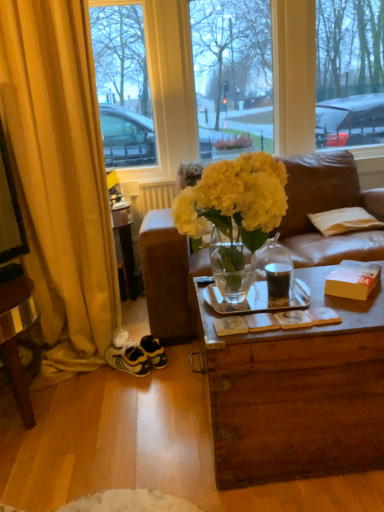
What is the approximate height of transparent glass window at center?

The height of transparent glass window at center is 3.78 feet.

What do you see at coordinates (167, 85) in the screenshot? The width and height of the screenshot is (384, 512). I see `transparent glass window at center` at bounding box center [167, 85].

You are a GUI agent. You are given a task and a screenshot of the screen. Output one action in this format:
    pyautogui.click(x=<x>, y=<y>)
    Task: Click on the orange cardboard box at right
    Image resolution: width=384 pixels, height=512 pixels.
    Given the screenshot: What is the action you would take?
    [353, 279]

Image resolution: width=384 pixels, height=512 pixels. What do you see at coordinates (353, 279) in the screenshot? I see `orange cardboard box at right` at bounding box center [353, 279].

Where is `white striped fabric pillow at right`? This screenshot has width=384, height=512. white striped fabric pillow at right is located at coordinates (344, 220).

Locate an element on the screen. white matte radiator at upper center is located at coordinates (150, 201).

You are a GUI agent. You are given a task and a screenshot of the screen. Output one action in this format:
    pyautogui.click(x=<x>, y=<y>)
    Task: Click on the yellow fabric curtain at left
    Image resolution: width=384 pixels, height=512 pixels.
    Given the screenshot: What is the action you would take?
    click(60, 179)

You are a GUI agent. You are given a task and a screenshot of the screen. Output one action in this format:
    pyautogui.click(x=<x>, y=<y>)
    Task: Click on the transparent glass window at center
    
    Given the screenshot: What is the action you would take?
    pyautogui.click(x=167, y=85)

Which object is thinner, yellow suede sneakers at lower left or transparent glass window at center?

transparent glass window at center is thinner.

Which object is positioned more to the right, yellow suede sneakers at lower left or transparent glass window at center?

Positioned to the right is transparent glass window at center.

Which is farther from the camera, (x=115, y=365) or (x=274, y=33)?

Positioned behind is point (x=274, y=33).

This screenshot has width=384, height=512. Find the location of `sneakers below the transparent glass window at center (from the image's perspective)`. sneakers below the transparent glass window at center (from the image's perspective) is located at coordinates (127, 356).

Are yellow suede sneakers at lower left and orange cardboard box at right located far from each other?

Actually, yellow suede sneakers at lower left and orange cardboard box at right are a little close together.

From the image's perspective, which is above, yellow suede sneakers at lower left or orange cardboard box at right?

orange cardboard box at right, from the image's perspective.

Is orange cardboard box at right at the back of yellow suede sneakers at lower left?

yellow suede sneakers at lower left is not turned away from orange cardboard box at right.

Is transparent glass window at center at the back of white matte radiator at upper center?

That's not correct — white matte radiator at upper center is not looking away from transparent glass window at center.

Consider the image. Is white matte radiator at upper center directly adjacent to transparent glass window at center?

white matte radiator at upper center and transparent glass window at center are clearly separated.

Considering the relative sizes of white matte radiator at upper center and transparent glass window at center in the image provided, is white matte radiator at upper center wider than transparent glass window at center?

No.

From the picture: In terms of size, does white matte radiator at upper center appear bigger or smaller than transparent glass window at center?

In the image, white matte radiator at upper center appears to be smaller than transparent glass window at center.

Is white striped fabric pillow at right next to yellow suede sneakers at lower left and touching it?

No, white striped fabric pillow at right is not in contact with yellow suede sneakers at lower left.

Which object is thinner, white striped fabric pillow at right or yellow suede sneakers at lower left?

With smaller width is white striped fabric pillow at right.

Considering the relative positions of white striped fabric pillow at right and yellow suede sneakers at lower left in the image provided, is white striped fabric pillow at right to the right of yellow suede sneakers at lower left from the viewer's perspective?

Yes.

Between white striped fabric pillow at right and orange cardboard box at right, which one has smaller width?

With smaller width is orange cardboard box at right.

Which object is closer to the camera taking this photo, white striped fabric pillow at right or orange cardboard box at right?

orange cardboard box at right is in front.

From the image's perspective, who appears lower, white striped fabric pillow at right or orange cardboard box at right?

orange cardboard box at right appears lower in the image.

From a real-world perspective, is white striped fabric pillow at right positioned over orange cardboard box at right based on gravity?

No, from a real-world perspective, white striped fabric pillow at right is not on top of orange cardboard box at right.

From the picture: Is yellow fabric curtain at left not inside transparent glass window at center?

Yes, yellow fabric curtain at left is located beyond the bounds of transparent glass window at center.

Considering the relative sizes of yellow fabric curtain at left and transparent glass window at center in the image provided, is yellow fabric curtain at left taller than transparent glass window at center?

Yes.

Which is more to the left, yellow fabric curtain at left or transparent glass window at center?

yellow fabric curtain at left is more to the left.

From the image's perspective, is yellow fabric curtain at left over transparent glass window at center?

Incorrect, from the image's perspective, yellow fabric curtain at left is lower than transparent glass window at center.

Does point (171, 192) come in front of point (337, 289)?

No, it is not.

How many degrees apart are the facing directions of white matte radiator at upper center and orange cardboard box at right?

The facing directions of white matte radiator at upper center and orange cardboard box at right are 41.7 degrees apart.

Consider the image. Is there a large distance between white matte radiator at upper center and orange cardboard box at right?

That's right, there is a large distance between white matte radiator at upper center and orange cardboard box at right.

Does white matte radiator at upper center appear on the left side of orange cardboard box at right?

Yes.

Where is `sneakers in front of the transparent glass window at center`? The image size is (384, 512). sneakers in front of the transparent glass window at center is located at coordinates (127, 356).

In order to click on sneakers that appears below the orange cardboard box at right (from a real-world perspective) in this screenshot , I will do `click(127, 356)`.

From the image, which object appears to be farther from white striped fabric pillow at right, transparent glass window at center or yellow suede sneakers at lower left?

Based on the image, yellow suede sneakers at lower left appears to be further to white striped fabric pillow at right.

From the image, which object appears to be farther from orange cardboard box at right, yellow suede sneakers at lower left or white matte radiator at upper center?

white matte radiator at upper center is positioned further to the anchor orange cardboard box at right.

From the image, which object appears to be farther from yellow fabric curtain at left, transparent glass window at center or orange cardboard box at right?

Based on the image, orange cardboard box at right appears to be further to yellow fabric curtain at left.

Considering their positions, is orange cardboard box at right positioned further to transparent glass window at center than translucent leather couch at center?

orange cardboard box at right is positioned further to the anchor transparent glass window at center.

Which object lies further to the anchor point orange cardboard box at right, white matte radiator at upper center or yellow suede sneakers at lower left?

white matte radiator at upper center lies further to orange cardboard box at right than the other object.

Considering their positions, is white matte radiator at upper center positioned further to yellow fabric curtain at left than translucent leather couch at center?

translucent leather couch at center.

Considering their positions, is orange cardboard box at right positioned further to white striped fabric pillow at right than white matte radiator at upper center?

white matte radiator at upper center lies further to white striped fabric pillow at right than the other object.

Consider the image. Considering their positions, is translucent leather couch at center positioned further to yellow fabric curtain at left than orange cardboard box at right?

Among the two, orange cardboard box at right is located further to yellow fabric curtain at left.

Locate an element on the screen. The image size is (384, 512). pillow positioned between translucent leather couch at center and white matte radiator at upper center from near to far is located at coordinates (344, 220).

Identify the location of radiator between yellow suede sneakers at lower left and white striped fabric pillow at right. The width and height of the screenshot is (384, 512). (150, 201).

Find the location of a particular element. This screenshot has height=512, width=384. studio couch between yellow suede sneakers at lower left and orange cardboard box at right from left to right is located at coordinates (327, 209).

At what (x,y) coordinates should I click in order to perform the action: click on box between translucent leather couch at center and white matte radiator at upper center in the front-back direction. Please return your answer as a coordinate pair (x, y). Looking at the image, I should click on (353, 279).